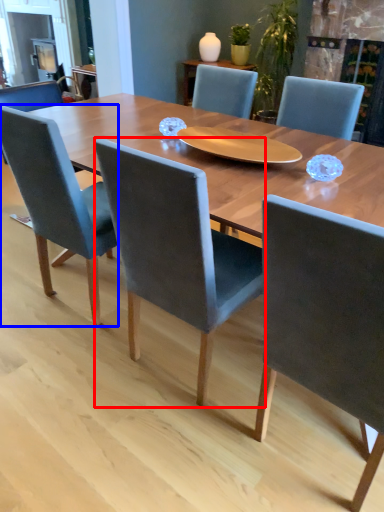
Question: Among these objects, which one is farthest to the camera, chair (highlighted by a red box) or chair (highlighted by a blue box)?

Choices:
 (A) chair
 (B) chair

Answer: (B)